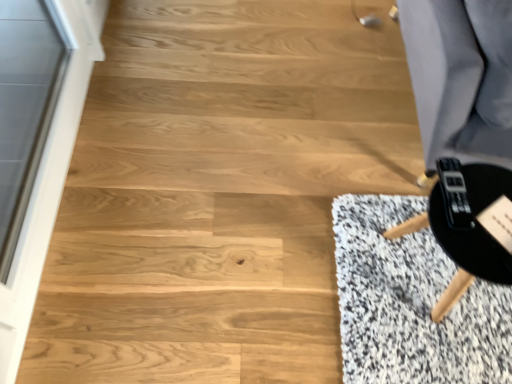
This screenshot has width=512, height=384. Find the location of `vacant space underneath black matte round table at lower right (from a real-world perspective)`. vacant space underneath black matte round table at lower right (from a real-world perspective) is located at coordinates 424,275.